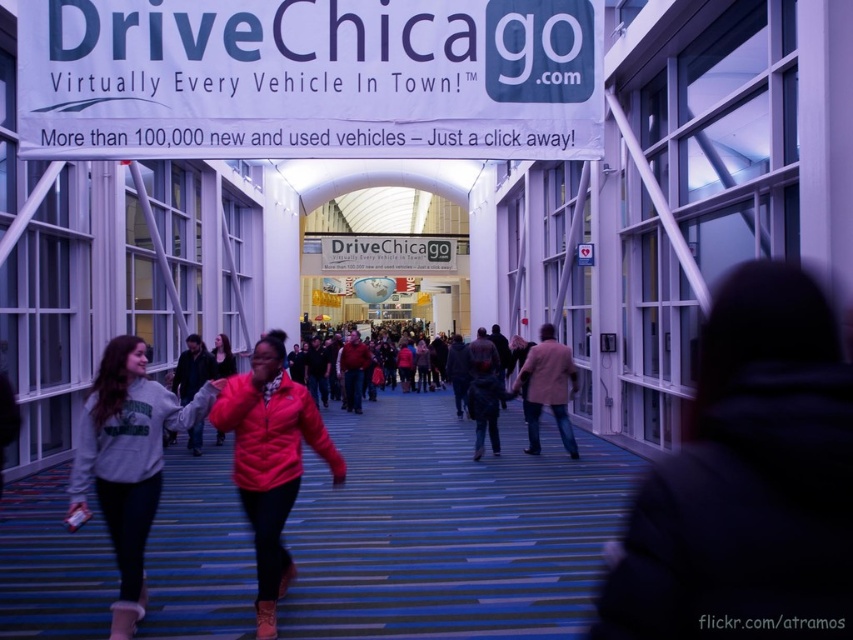
You are a visitor at the convention center and need to read both the white paper sign at upper center and the white plastic sign at center. Which sign should you look at first if you want to read the one that is bigger?

The white paper sign at upper center has a larger size compared to the white plastic sign at center, so you should look at the white paper sign at upper center first.

You are a visitor at the convention center and you see the white paper sign at upper center and the white plastic sign at center. Which one is taller?

The white paper sign at upper center is taller than the white plastic sign at center.

Consider the image. You are a visitor at the convention center and want to read the text on the white paper sign at upper center. However, you are currently standing next to the beige woolen jacket at center. Do you need to move closer to read the sign properly?

The white paper sign at upper center is wider than the beige woolen jacket at center. Since the sign is larger, it might be easier to read from a distance. However, if the text is small or you have trouble seeing, moving closer could help. The size difference alone doesn